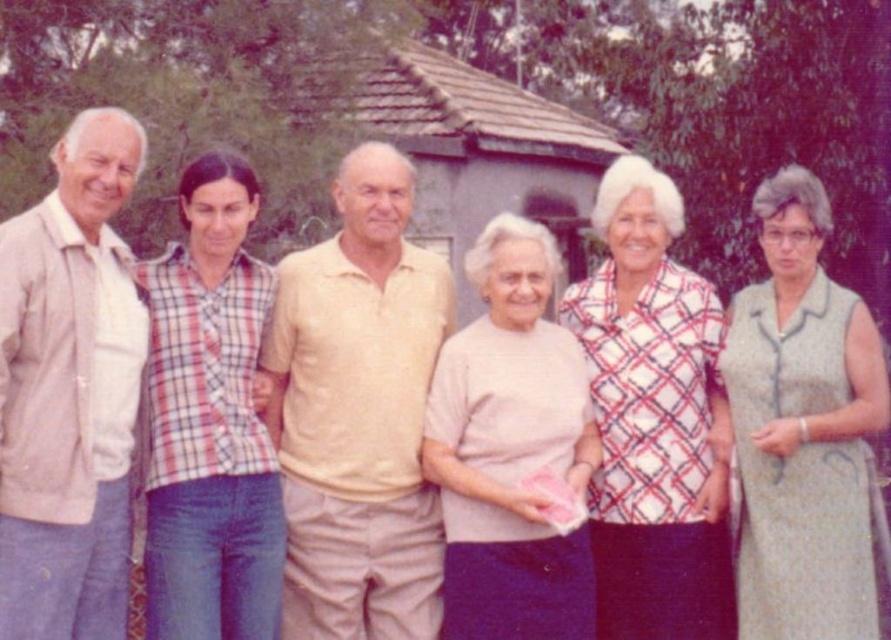
Is light gray textured dress at center right further to the viewer compared to plaid fabric blouse at center?

No.

Measure the distance between light gray textured dress at center right and camera.

A distance of 16.19 feet exists between light gray textured dress at center right and camera.

Which is in front, point (846, 589) or point (634, 198)?

Point (846, 589)

The height and width of the screenshot is (640, 891). I want to click on light gray textured dress at center right, so click(804, 432).

Does light yellow cotton shirt at center appear on the right side of light gray textured dress at center right?

In fact, light yellow cotton shirt at center is to the left of light gray textured dress at center right.

Who is more forward, (353,548) or (849,292)?

Point (849,292) is in front.

Does point (342, 300) come closer to viewer compared to point (849, 515)?

No, it is not.

The height and width of the screenshot is (640, 891). I want to click on light yellow cotton shirt at center, so click(x=358, y=413).

Does beige cotton jacket at left have a greater height compared to plaid cotton shirt at center?

No, beige cotton jacket at left is not taller than plaid cotton shirt at center.

Does point (121, 186) lie behind point (182, 202)?

No, it is in front of (182, 202).

Which is behind, point (113, 349) or point (146, 384)?

The point (146, 384) is more distant.

Image resolution: width=891 pixels, height=640 pixels. What are the coordinates of `beige cotton jacket at left` in the screenshot? It's located at (69, 390).